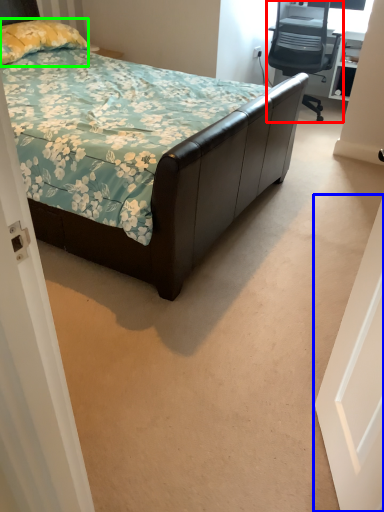
Question: Which is nearer to the chair (highlighted by a red box)? door (highlighted by a blue box) or pillow (highlighted by a green box).

Choices:
 (A) door
 (B) pillow

Answer: (B)